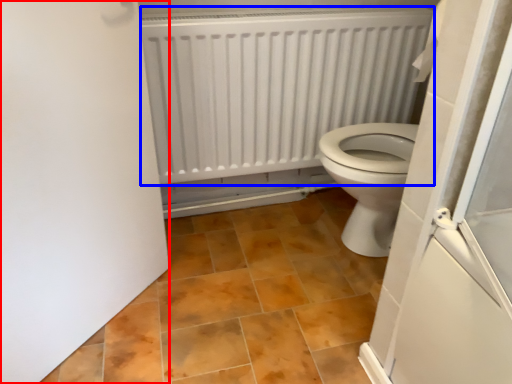
Question: Which point is further to the camera, door (highlighted by a red box) or radiator (highlighted by a blue box)?

Choices:
 (A) door
 (B) radiator

Answer: (B)